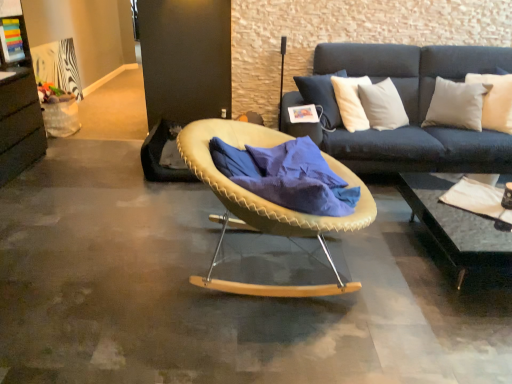
Question: Is beige woven chair at center wider than white soft cushion at upper right?

Choices:
 (A) yes
 (B) no

Answer: (A)

Question: From the image's perspective, is beige woven chair at center over white soft cushion at upper right?

Choices:
 (A) no
 (B) yes

Answer: (A)

Question: From a real-world perspective, does beige woven chair at center sit lower than white soft cushion at upper right?

Choices:
 (A) no
 (B) yes

Answer: (B)

Question: Is beige woven chair at center at the right side of white soft cushion at upper right?

Choices:
 (A) yes
 (B) no

Answer: (B)

Question: Considering the relative positions of beige woven chair at center and white soft cushion at upper right in the image provided, is beige woven chair at center to the left of white soft cushion at upper right from the viewer's perspective?

Choices:
 (A) yes
 (B) no

Answer: (A)

Question: From the image's perspective, would you say beige woven chair at center is shown under white soft cushion at upper right?

Choices:
 (A) no
 (B) yes

Answer: (B)

Question: Is blue soft fabric at center to the right of white soft cushion at upper right from the viewer's perspective?

Choices:
 (A) no
 (B) yes

Answer: (A)

Question: Does blue soft fabric at center have a lesser width compared to white soft cushion at upper right?

Choices:
 (A) no
 (B) yes

Answer: (A)

Question: From the image's perspective, would you say blue soft fabric at center is shown under white soft cushion at upper right?

Choices:
 (A) no
 (B) yes

Answer: (B)

Question: Can you confirm if blue soft fabric at center is shorter than white soft cushion at upper right?

Choices:
 (A) yes
 (B) no

Answer: (A)

Question: Would you say blue soft fabric at center is a long distance from white soft cushion at upper right?

Choices:
 (A) no
 (B) yes

Answer: (B)

Question: Is the depth of blue soft fabric at center greater than that of white soft cushion at upper right?

Choices:
 (A) no
 (B) yes

Answer: (A)

Question: Is the depth of black glass coffee table at lower right less than that of beige woven chair at center?

Choices:
 (A) yes
 (B) no

Answer: (B)